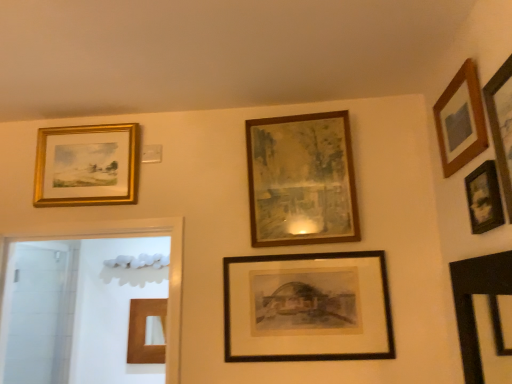
Question: Is black matte picture frame at center, which appears as the fourth picture frame when viewed from the right, bigger or smaller than gold/gilded picture frame at upper left, the 1th picture frame from the left?

Choices:
 (A) small
 (B) big

Answer: (A)

Question: From a real-world perspective, is black matte picture frame at center, which appears as the fourth picture frame when viewed from the right, above or below gold/gilded picture frame at upper left, the 1th picture frame from the left?

Choices:
 (A) above
 (B) below

Answer: (B)

Question: Which object is the farthest from the wooden picture frame at upper right, which is the 6th picture frame in left-to-right order?

Choices:
 (A) black matte picture frame at center, which appears as the 3th picture frame when viewed from the left
 (B) wooden picture frame at upper right, positioned as the 3th picture frame in right-to-left order
 (C) gold/gilded picture frame at upper left, which is counted as the sixth picture frame, starting from the right
 (D) wooden frame at center, the second picture frame when ordered from left to right
 (E) wooden photo frame at upper right, which ranks as the fifth picture frame in left-to-right order

Answer: (C)

Question: Estimate the real-world distances between objects in this image. Which object is closer to the black matte picture frame at center, which appears as the fourth picture frame when viewed from the right?

Choices:
 (A) wooden frame at center, placed as the fifth picture frame when sorted from right to left
 (B) gold/gilded picture frame at upper left, which is counted as the sixth picture frame, starting from the right
 (C) wooden photo frame at upper right, the second picture frame when ordered from right to left
 (D) wooden picture frame at upper right, positioned as the 3th picture frame in right-to-left order
 (E) wooden picture frame at upper right, which is the 6th picture frame in left-to-right order

Answer: (A)